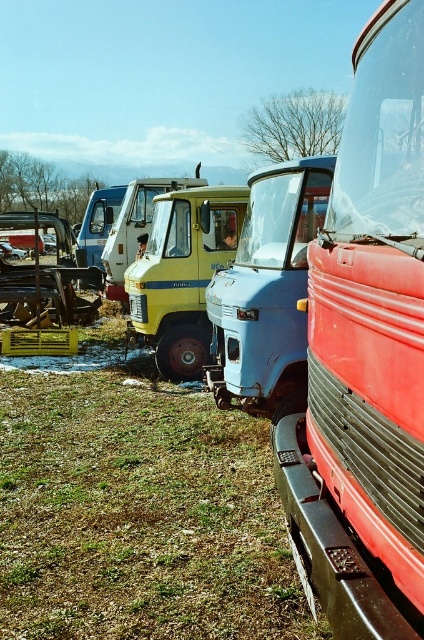
Question: Which point is closer to the camera taking this photo?

Choices:
 (A) (7, 259)
 (B) (35, 241)
 (C) (406, 205)

Answer: (C)

Question: Estimate the real-world distances between objects in this image. Which object is farther from the wooden frame at left?

Choices:
 (A) matte blue truck at center
 (B) green grass at lower left

Answer: (A)

Question: Where is wooden frame at left located in relation to metallic silver car at center in the image?

Choices:
 (A) right
 (B) left

Answer: (A)

Question: Is wooden frame at left below metallic silver car at center?

Choices:
 (A) yes
 (B) no

Answer: (A)

Question: Among these points, which one is nearest to the camera?

Choices:
 (A) (14, 252)
 (B) (10, 401)
 (C) (39, 298)
 (D) (349, 342)

Answer: (D)

Question: Can you confirm if matte blue truck at center is thinner than metallic silver car at center?

Choices:
 (A) yes
 (B) no

Answer: (A)